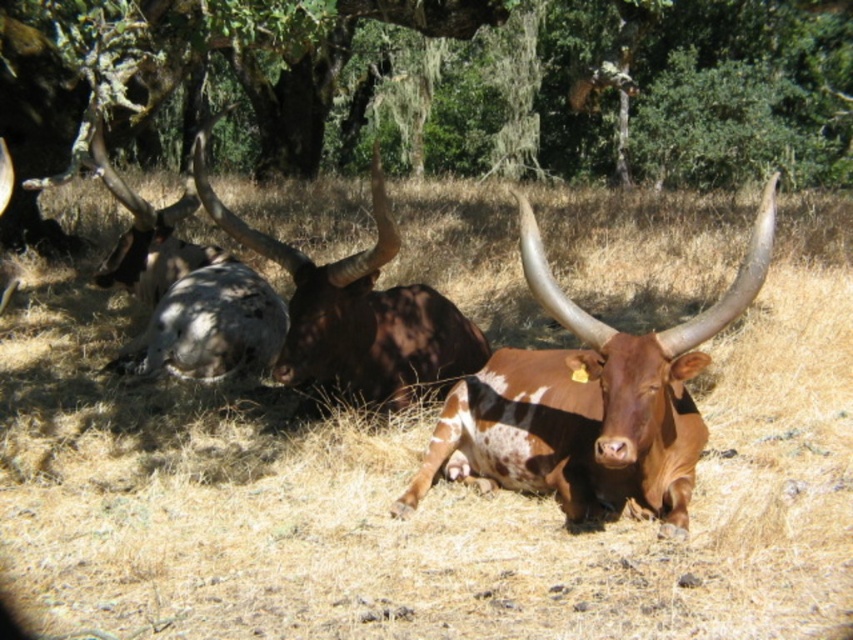
In the scene shown: You are standing at the point with coordinates (x=589, y=403) in the scene. What object is located exactly at that point?

The brown speckled hide at center is located exactly at point (x=589, y=403).

In the scene shown: You are a photographer trying to capture a closeup of the brown dry grass at center and the green leafy tree at upper center in the same frame. Which object will appear larger in your photo?

The brown dry grass at center will appear larger in the photo because it is closer to the viewer than the green leafy tree at upper center.

You are a farmer checking on your cattle. You see the brown dry grass at center and the brown speckled hide at center. Which object is higher in the scene?

The brown dry grass at center is above the brown speckled hide at center in the scene.